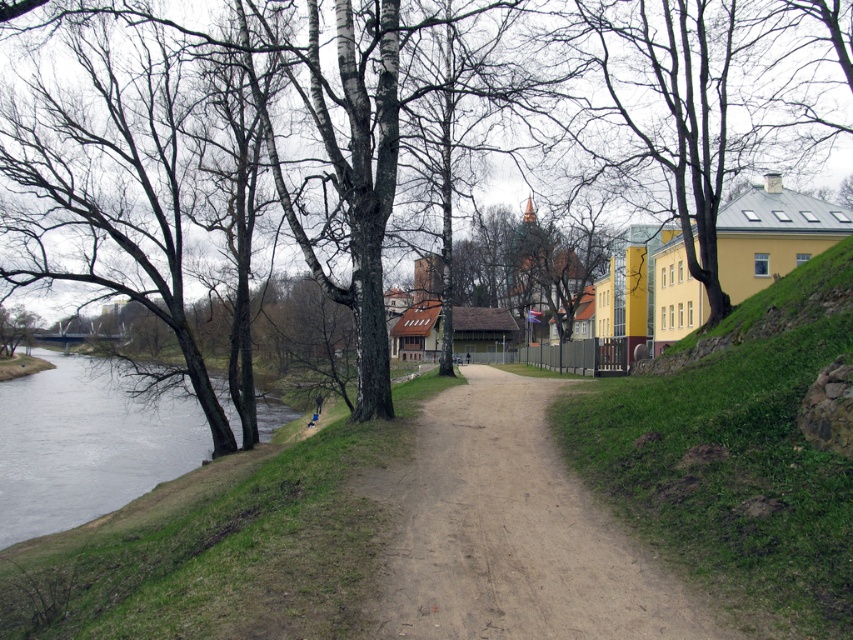
You are standing on the dirt path and want to take a photo of the brown bark tree at left and the gray water at lower left. Which object will appear closer to the camera in the photo?

The brown bark tree at left will appear closer to the camera in the photo because it is positioned in front of the gray water at lower left.

You are a hiker trying to cross the gray water at lower left using the brown bark tree at left. Can you safely step from the tree onto the water?

The brown bark tree at left is positioned on the right side of gray water at lower left, but since water is a liquid and not solid, you cannot safely step from the brown bark tree at left onto the gray water at lower left.

You are planning to walk along the brown sandy dirt track at center. There is a brown bark tree at left nearby. If you want to avoid the tree, which direction should you walk towards?

The brown bark tree at left is wider than the brown sandy dirt track at center, so to avoid the tree, you should walk towards the narrower part of the track away from the tree.